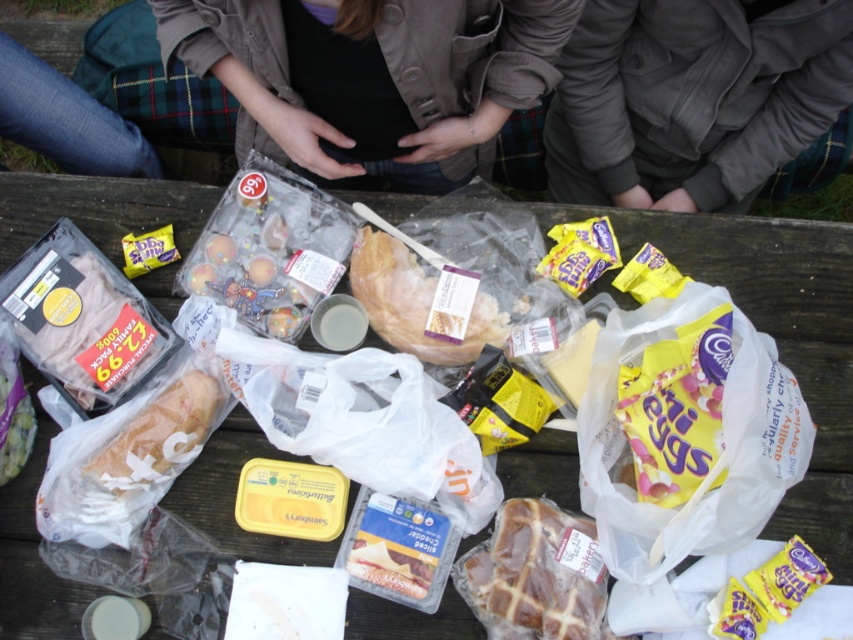
You are a person who is 5 feet 6 inches tall standing at the edge of the picnic table. You want to pick up the gray fabric jacket at upper center. Can you reach it without moving your feet?

The gray fabric jacket at upper center is 36.73 inches away from the viewer. Since the average arm reach for a person of that height is about 28 to 30 inches, you cannot reach it without moving your feet.

You are a guest at a picnic and want to reach for the golden brown glazed hot cross bun at center. However, there is a black fabric shirt at center in your way. Can you easily access the hot cross bun without moving the shirt?

The black fabric shirt at center is in front of the golden brown glazed hot cross bun at center, so you cannot easily access the hot cross bun without moving the shirt.

You are standing at the picnic table and want to grab the item closest to you. Which point should you reach for? The point at coordinates (x=421, y=64) or the point at coordinates (x=567, y=531)?

You should reach for the point at coordinates (x=421, y=64) because it is closer to the camera than the point at coordinates (x=567, y=531).